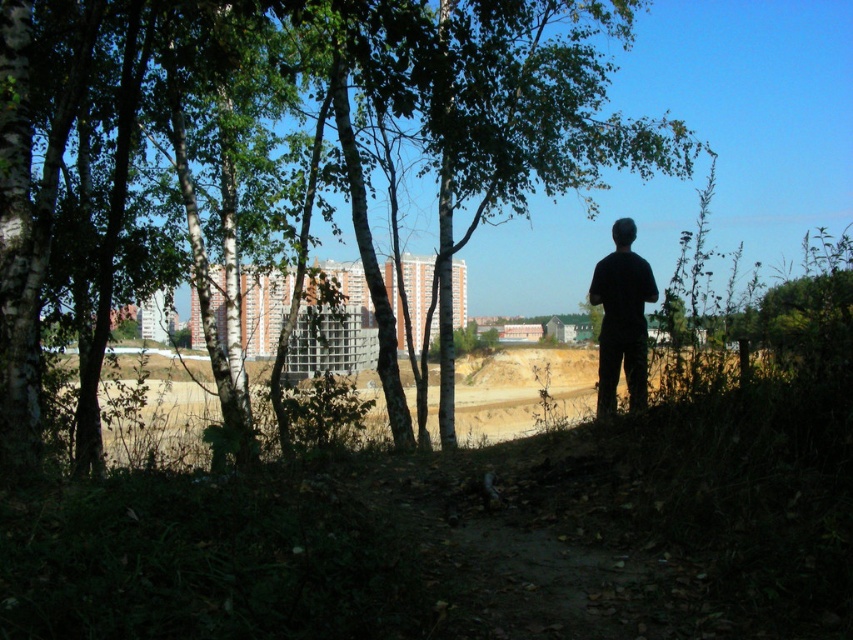
Question: Does green leafy tree at center lie behind black matte shirt at center?

Choices:
 (A) no
 (B) yes

Answer: (A)

Question: Does green leafy tree at center have a lesser width compared to black matte shirt at center?

Choices:
 (A) no
 (B) yes

Answer: (A)

Question: Which point appears closest to the camera in this image?

Choices:
 (A) (474, 141)
 (B) (634, 410)

Answer: (B)

Question: Does green leafy tree at center appear on the left side of black matte shirt at center?

Choices:
 (A) no
 (B) yes

Answer: (B)

Question: Which of the following is the farthest from the observer?

Choices:
 (A) green leafy tree at center
 (B) black matte shirt at center

Answer: (B)